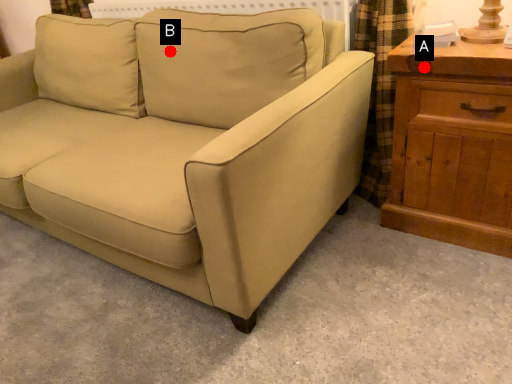
Question: Two points are circled on the image, labeled by A and B beside each circle. Among these points, which one is nearest to the camera?

Choices:
 (A) A is closer
 (B) B is closer

Answer: (A)